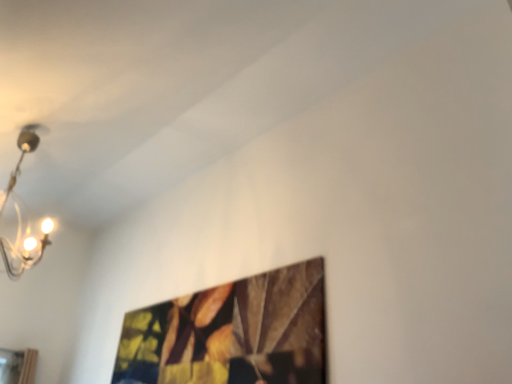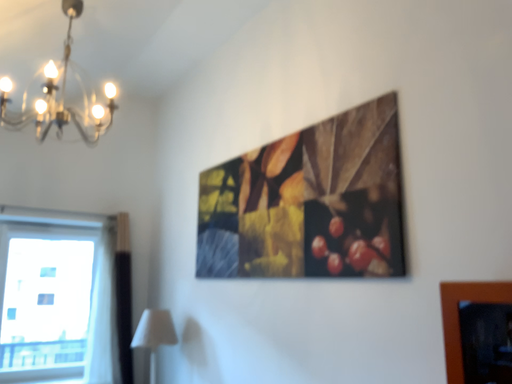
Question: How did the camera likely rotate when shooting the video?

Choices:
 (A) rotated right
 (B) rotated left

Answer: (B)